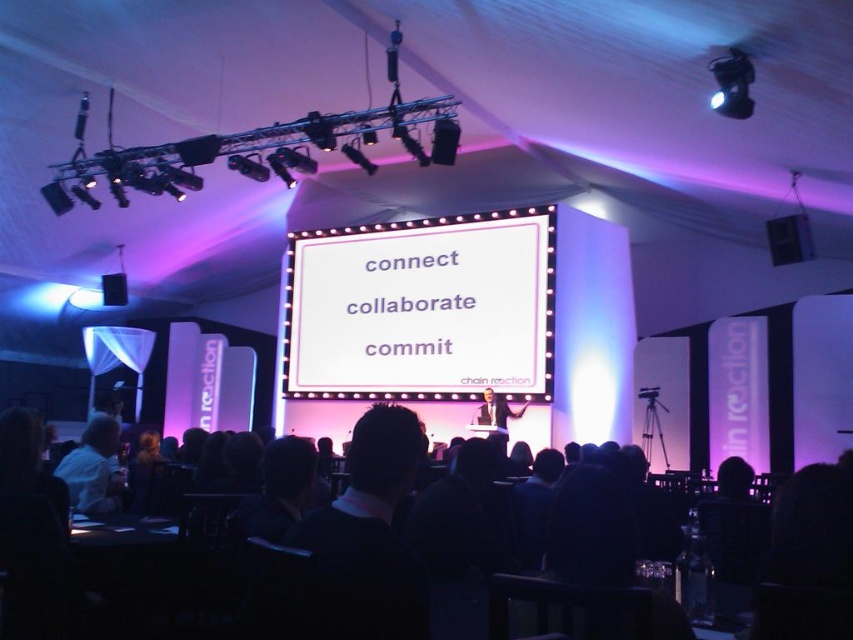
You are sitting in the audience and want to see two points on the stage. The first point is at coordinates point [65,588] and the second is at point [497,417]. Which point will appear closer to you?

Point [65,588] is closer to the viewer than point [497,417], so the first point will appear closer to you.

You are standing at the center of the conference room and need to locate the black matte speaker at upper right. Based on the coordinate system where the bottom left corner is the origin, can you determine if the speaker is closer to the top or the right side of the room?

The black matte speaker at upper right is located at coordinate point 0.373 on the x axis and 0.926 on the y axis. Since the y value is closer to 1 than the x value, the speaker is closer to the top of the room.